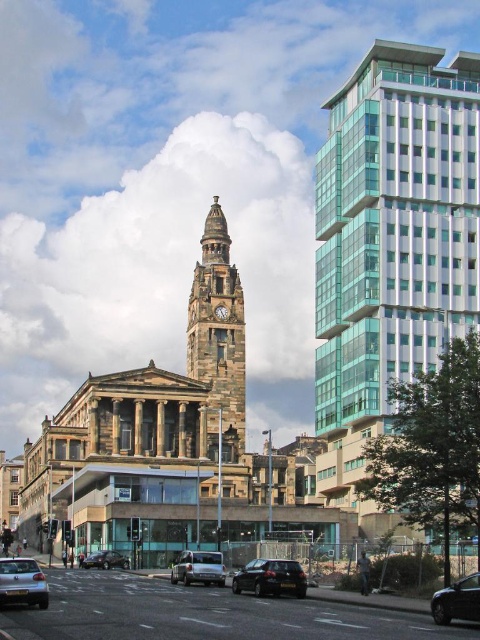
Question: Among these objects, which one is nearest to the camera?

Choices:
 (A) silver metallic van at center
 (B) stone clock tower at center

Answer: (A)

Question: Does glassy teal skyscraper at right have a smaller size compared to shiny black sedan at center?

Choices:
 (A) yes
 (B) no

Answer: (B)

Question: Is stone clock tower at center above silver metallic van at center?

Choices:
 (A) no
 (B) yes

Answer: (B)

Question: Does stone clock tower at center appear on the right side of green marble clock at center?

Choices:
 (A) no
 (B) yes

Answer: (A)

Question: Which point appears farthest from the camera in this image?

Choices:
 (A) (95, 554)
 (B) (456, 596)

Answer: (A)

Question: Which object is the closest to the shiny black car at lower right?

Choices:
 (A) stone clock tower at center
 (B) silver metallic hatchback at lower left
 (C) shiny black sedan at center

Answer: (C)